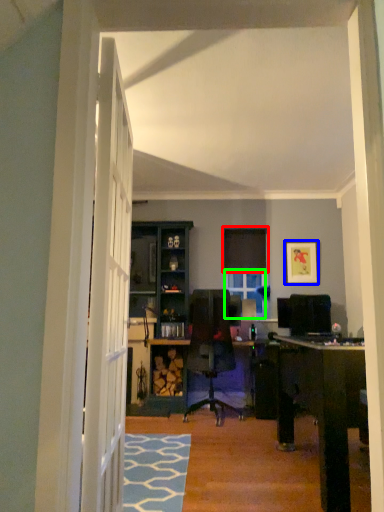
Question: Based on their relative distances, which object is farther from curtain (highlighted by a red box)? Choose from picture frame (highlighted by a blue box) and window (highlighted by a green box).

Choices:
 (A) picture frame
 (B) window

Answer: (A)